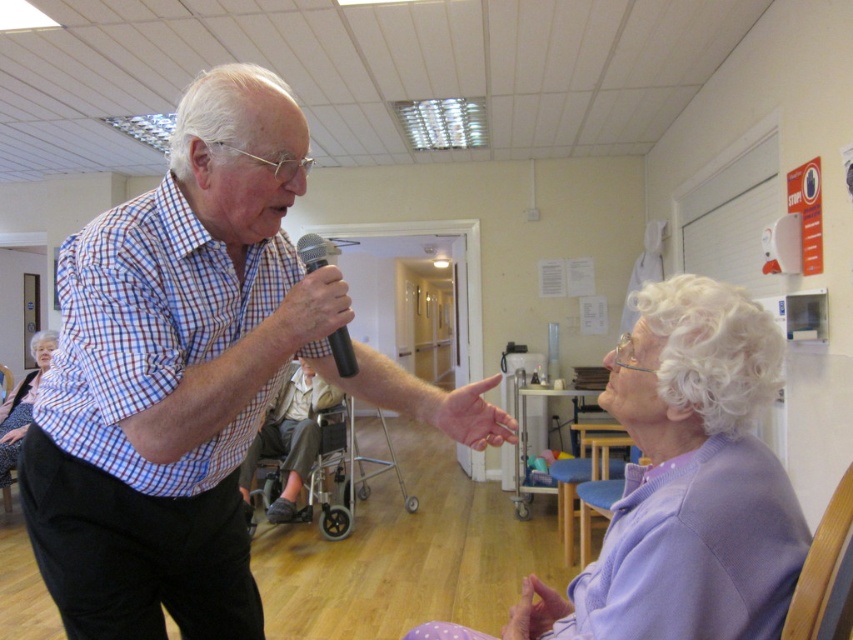
Locate an element on the screen. blue checkered shirt at upper left is located at coordinates (190, 374).

Can you confirm if blue checkered shirt at upper left is bigger than purple fabric at lower right?

Yes, blue checkered shirt at upper left is bigger than purple fabric at lower right.

Which is behind, point (316, 275) or point (799, 508)?

Positioned behind is point (316, 275).

This screenshot has width=853, height=640. I want to click on blue checkered shirt at upper left, so point(190,374).

Is point (633, 483) more distant than point (804, 570)?

That is True.

This screenshot has width=853, height=640. What do you see at coordinates (686, 483) in the screenshot? I see `purple fabric at lower right` at bounding box center [686, 483].

What do you see at coordinates (686, 483) in the screenshot? The height and width of the screenshot is (640, 853). I see `purple fabric at lower right` at bounding box center [686, 483].

Identify the location of purple fabric at lower right. click(686, 483).

Measure the distance between blue checkered shirt at upper left and metallic gray wheelchair at center.

The distance of blue checkered shirt at upper left from metallic gray wheelchair at center is 3.21 meters.

Which is more to the right, blue checkered shirt at upper left or metallic gray wheelchair at center?

blue checkered shirt at upper left is more to the right.

Is point (148, 211) behind point (323, 474)?

No, (148, 211) is closer to viewer.

Image resolution: width=853 pixels, height=640 pixels. In order to click on blue checkered shirt at upper left in this screenshot , I will do `click(190, 374)`.